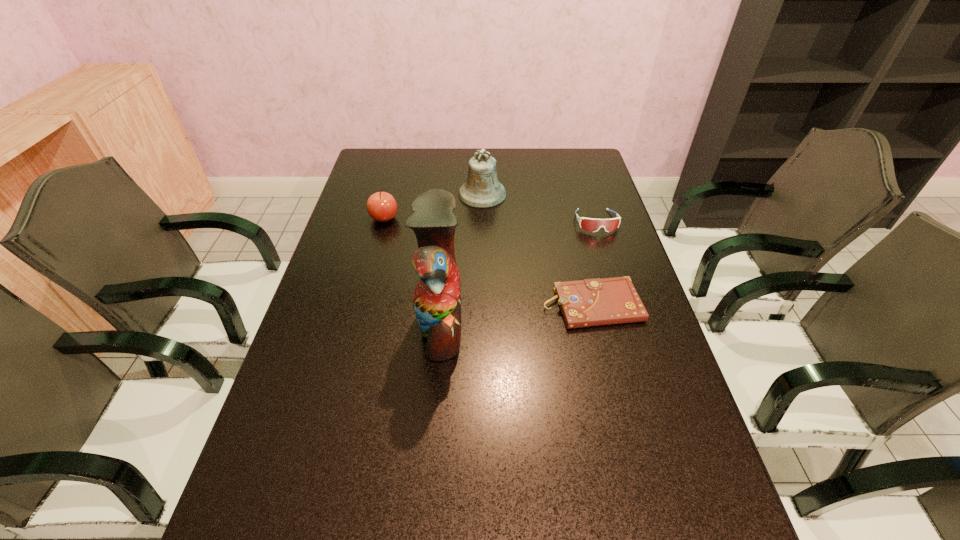
You are a GUI agent. You are given a task and a screenshot of the screen. Output one action in this format:
    pyautogui.click(x=<x>, y=<y>)
    Task: Click on the free region located on the front-facing side of the fourth tallest object
    This screenshot has width=960, height=540.
    Given the screenshot: What is the action you would take?
    pyautogui.click(x=615, y=284)

You are a GUI agent. You are given a task and a screenshot of the screen. Output one action in this format:
    pyautogui.click(x=<x>, y=<y>)
    Task: Click on the vacant region located on the back of the shortest object
    Image resolution: width=960 pixels, height=540 pixels.
    Given the screenshot: What is the action you would take?
    pyautogui.click(x=565, y=200)

In order to click on object at the left edge in this screenshot , I will do `click(381, 206)`.

Where is `goggles situated at the right edge`? goggles situated at the right edge is located at coordinates (589, 224).

At what (x,y) coordinates should I click in order to perform the action: click on notebook present at the right edge. Please return your answer as a coordinate pair (x, y). This screenshot has width=960, height=540. Looking at the image, I should click on pyautogui.click(x=590, y=302).

In order to click on vacant space at the far edge in this screenshot , I will do `click(437, 150)`.

The width and height of the screenshot is (960, 540). In the image, there is a desktop. Find the location of `free space at the left edge`. free space at the left edge is located at coordinates [374, 269].

The height and width of the screenshot is (540, 960). Find the location of `free region at the right edge`. free region at the right edge is located at coordinates (608, 250).

Where is `free location at the far left corner of the desktop`? The height and width of the screenshot is (540, 960). free location at the far left corner of the desktop is located at coordinates (406, 170).

This screenshot has width=960, height=540. Find the location of `blank region between the second tallest object and the shortest object`. blank region between the second tallest object and the shortest object is located at coordinates (537, 249).